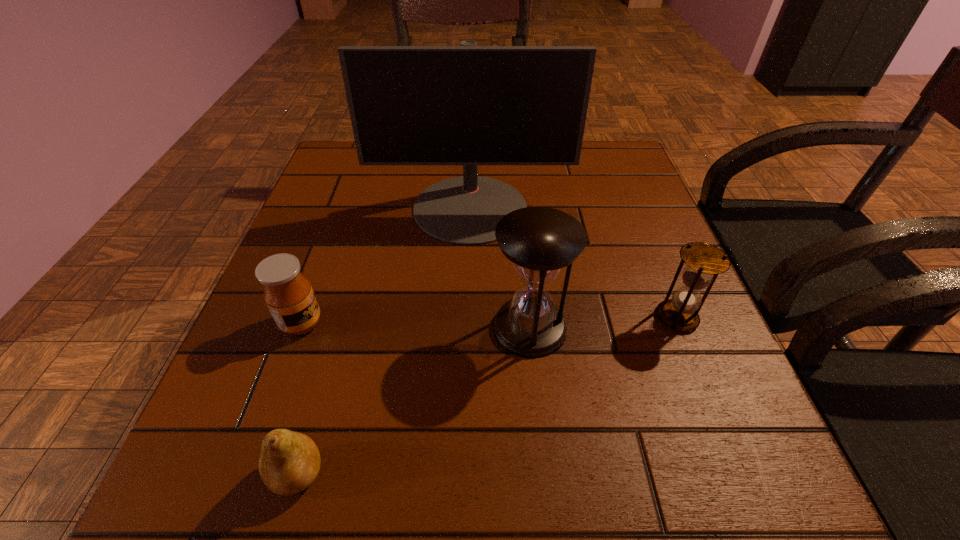
Image resolution: width=960 pixels, height=540 pixels. I want to click on vacant area located 0.330m on the back of the rightmost object, so click(628, 198).

Image resolution: width=960 pixels, height=540 pixels. I want to click on vacant space located on the front-facing side of the honey, so click(465, 323).

Where is `blank space located on the back of the pear`? This screenshot has width=960, height=540. blank space located on the back of the pear is located at coordinates click(x=351, y=285).

This screenshot has width=960, height=540. Identify the location of object positioned at the far edge. (469, 105).

Where is `object at the near edge`? The height and width of the screenshot is (540, 960). object at the near edge is located at coordinates (290, 461).

Where is `computer monitor that is at the left edge`? computer monitor that is at the left edge is located at coordinates pos(469,105).

The image size is (960, 540). Identify the location of honey that is positioned at the left edge. (288, 294).

Where is `pear located at the left edge`? The height and width of the screenshot is (540, 960). pear located at the left edge is located at coordinates (290, 461).

The height and width of the screenshot is (540, 960). I want to click on object that is at the right edge, so click(704, 262).

I want to click on object at the far left corner, so click(x=469, y=105).